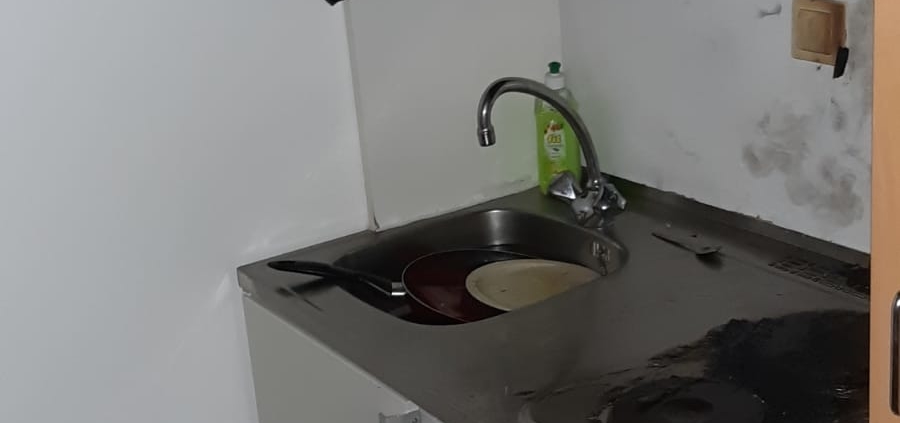
At what (x,y) coordinates should I click in order to perform the action: click on counter top. Please return your answer as a coordinate pair (x, y). Looking at the image, I should click on (568, 335).